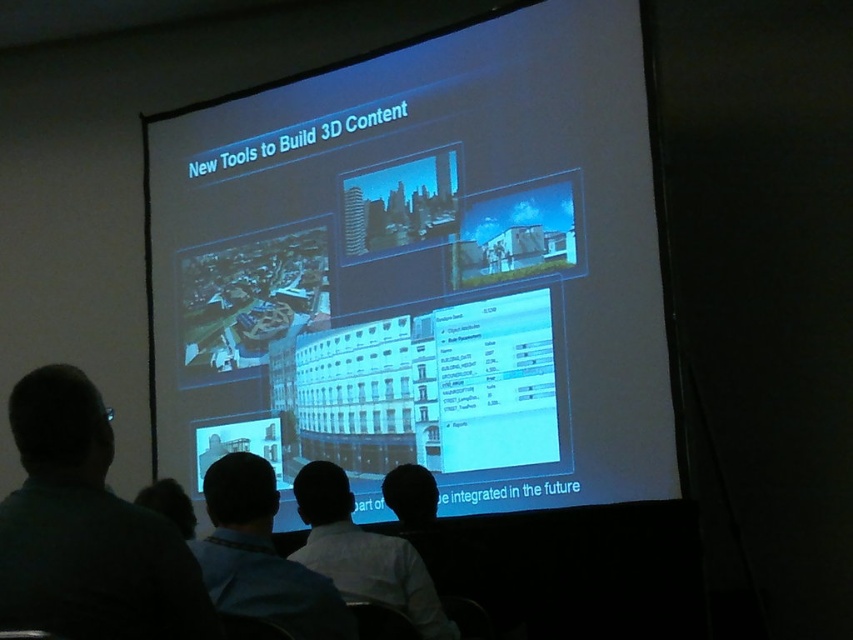
Question: Which point is closer to the camera taking this photo?

Choices:
 (A) (299, 556)
 (B) (218, 378)
 (C) (88, 413)

Answer: (C)

Question: Does white matte screen at center appear over blue shirt at center?

Choices:
 (A) yes
 (B) no

Answer: (A)

Question: Which object appears farthest from the camera in this image?

Choices:
 (A) white matte screen at center
 (B) dark green shirt at lower left
 (C) white shirt at lower center

Answer: (A)

Question: Is white matte screen at center above white shirt at lower center?

Choices:
 (A) yes
 (B) no

Answer: (A)

Question: Is white matte screen at center smaller than white shirt at lower center?

Choices:
 (A) no
 (B) yes

Answer: (A)

Question: Based on their relative distances, which object is farther from the dark green shirt at lower left?

Choices:
 (A) white matte screen at center
 (B) white shirt at lower center

Answer: (A)